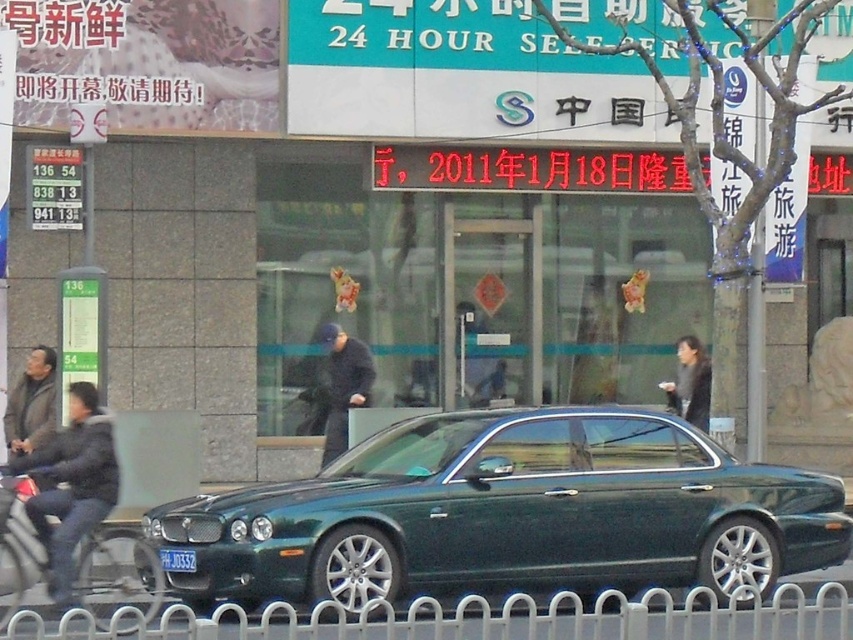
Does metallic green car at center have a larger size compared to green metallic license plate at center?

Yes, metallic green car at center is bigger than green metallic license plate at center.

The width and height of the screenshot is (853, 640). What do you see at coordinates (509, 515) in the screenshot? I see `metallic green car at center` at bounding box center [509, 515].

Locate an element on the screen. This screenshot has width=853, height=640. metallic green car at center is located at coordinates (509, 515).

Who is lower down, dark green car at center or green metallic license plate at center?

green metallic license plate at center

Between dark green car at center and green metallic license plate at center, which one appears on the left side from the viewer's perspective?

Positioned to the left is green metallic license plate at center.

Is point (689, 337) positioned after point (178, 563)?

Yes, point (689, 337) is behind point (178, 563).

Where is `dark green car at center`? The height and width of the screenshot is (640, 853). dark green car at center is located at coordinates [x=689, y=384].

Between point (4, 595) and point (173, 561), which one is positioned behind?

Point (4, 595)

Is metallic silver bicycle at lower left smaller than green metallic license plate at center?

No, metallic silver bicycle at lower left is not smaller than green metallic license plate at center.

Which is behind, point (74, 573) or point (173, 570)?

Point (74, 573)

The height and width of the screenshot is (640, 853). What are the coordinates of `metallic silver bicycle at lower left` in the screenshot? It's located at 115,573.